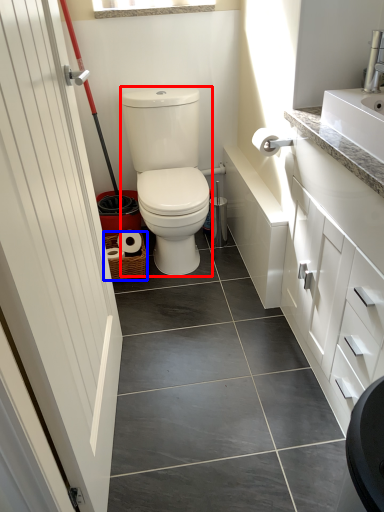
Question: Which of the following is the farthest to the observer, sit (highlighted by a red box) or basket (highlighted by a blue box)?

Choices:
 (A) sit
 (B) basket

Answer: (B)